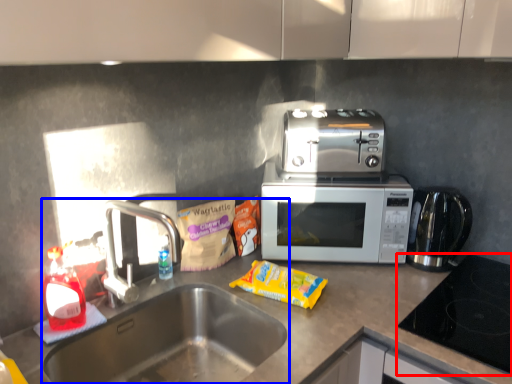
Question: Which point is further to the camera, gas stove (highlighted by a red box) or sink (highlighted by a blue box)?

Choices:
 (A) gas stove
 (B) sink

Answer: (A)